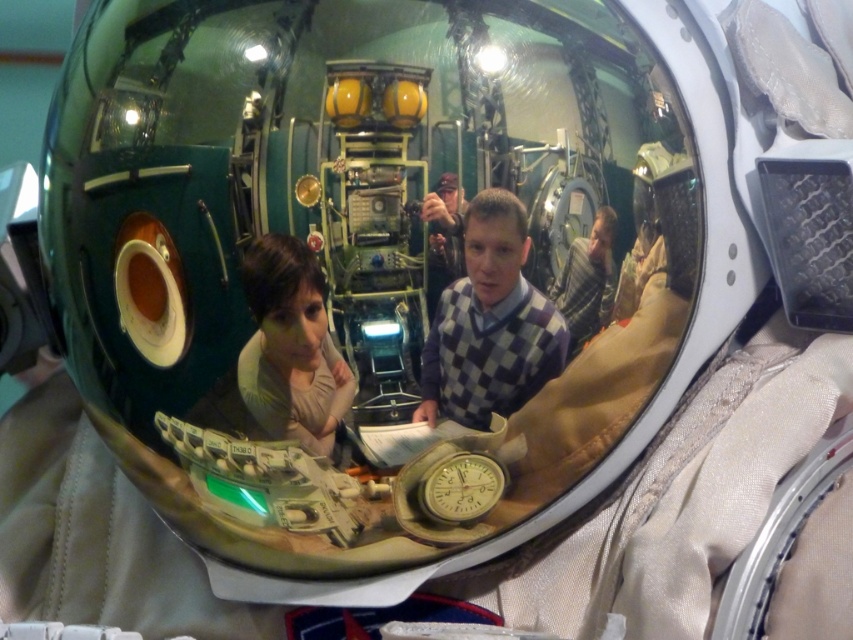
You are an astronaut in a space helmet. You notice a matte beige shirt at center reflected in your helmet. You want to take a photo of it with your camera. Can you do so without moving your head?

The matte beige shirt at center and camera are 14.34 inches apart. Since the camera is within reach while keeping your head stationary, you can take the photo.